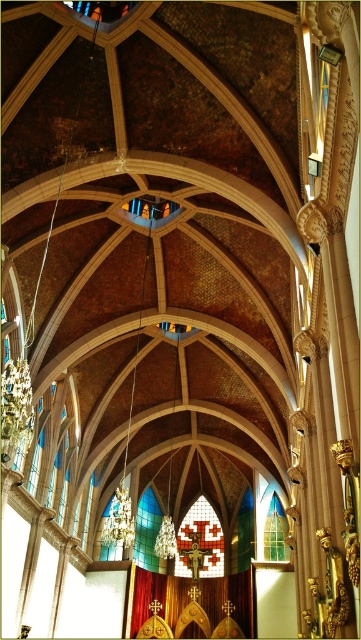
Is point (158, 564) in front of point (107, 554)?

No, (158, 564) is behind (107, 554).

Does point (145, 496) come farther from viewer compared to point (105, 512)?

Yes, it is.

Locate an element on the screen. This screenshot has height=640, width=361. multicolored stained glass at center is located at coordinates (146, 531).

Is translucent stained glass at center positioned at the back of stained glass window at center?

No, translucent stained glass at center is in front of stained glass window at center.

Can you confirm if translucent stained glass at center is shorter than stained glass window at center?

Incorrect, translucent stained glass at center's height does not fall short of stained glass window at center's.

Where is `translucent stained glass at center`? Image resolution: width=361 pixels, height=640 pixels. translucent stained glass at center is located at coordinates (270, 522).

At what (x,y) coordinates should I click in order to perform the action: click on translucent stained glass at center. Please return your answer as a coordinate pair (x, y). Looking at the image, I should click on (270, 522).

Does translucent stained glass at center have a lesser width compared to multicolored stained glass at center?

No, translucent stained glass at center is not thinner than multicolored stained glass at center.

Does translucent stained glass at center have a greater height compared to multicolored stained glass at center?

No.

I want to click on translucent stained glass at center, so click(270, 522).